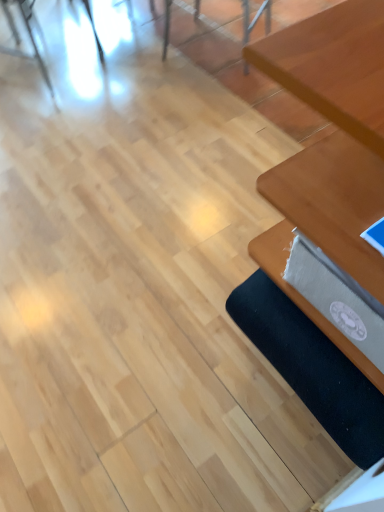
You are a GUI agent. You are given a task and a screenshot of the screen. Output one action in this format:
    pyautogui.click(x=<x>, y=<y>)
    Task: Click on the blank space above black fabric yoga mat at lower right (from a real-world perspective)
    The width and height of the screenshot is (384, 512).
    Given the screenshot: What is the action you would take?
    pyautogui.click(x=311, y=346)